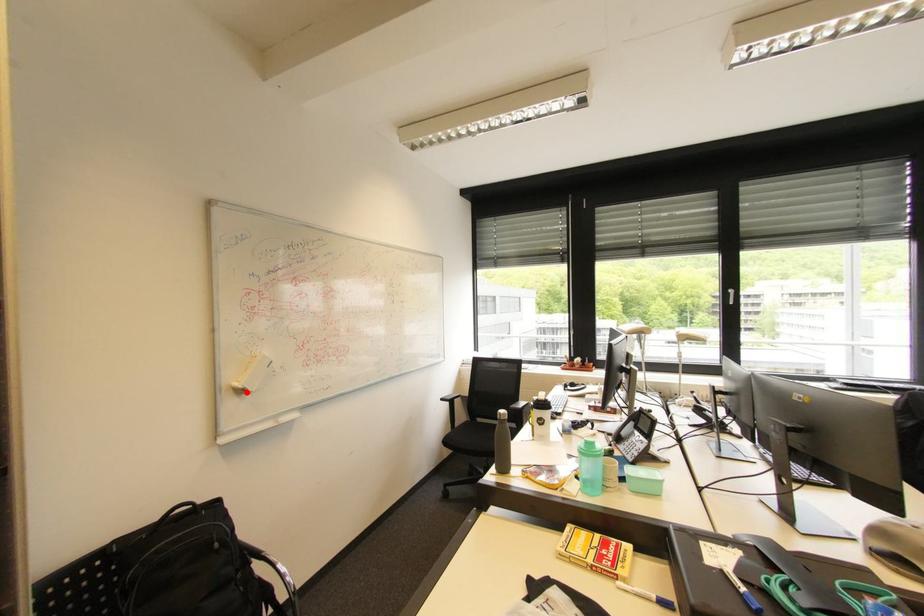
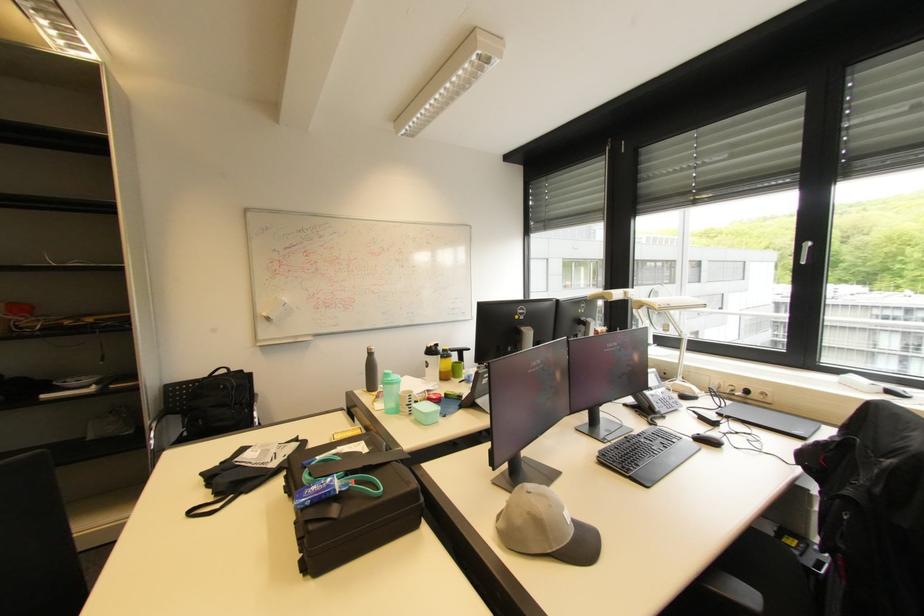
Where in the second image is the point corresponding to the highlighted location from the first image?

(273, 320)